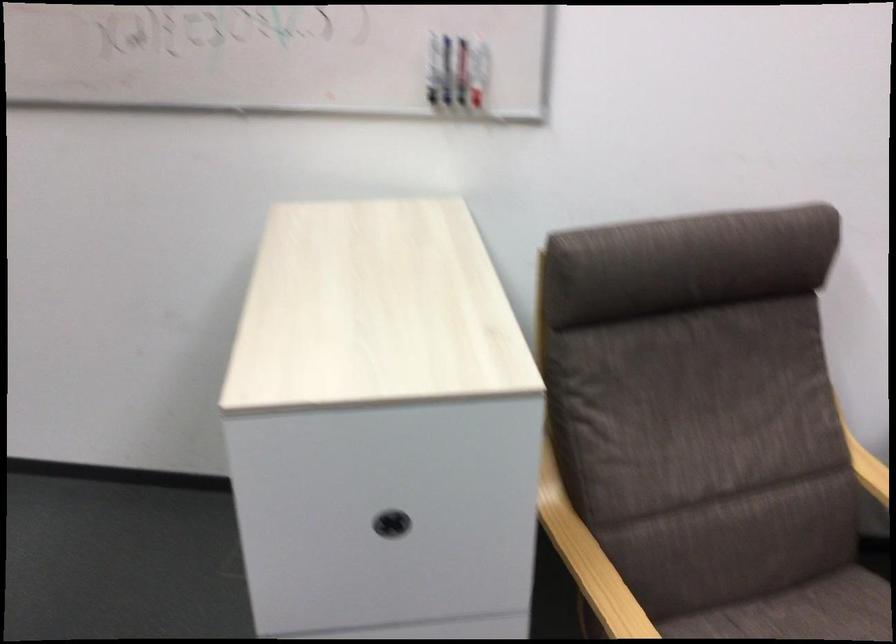
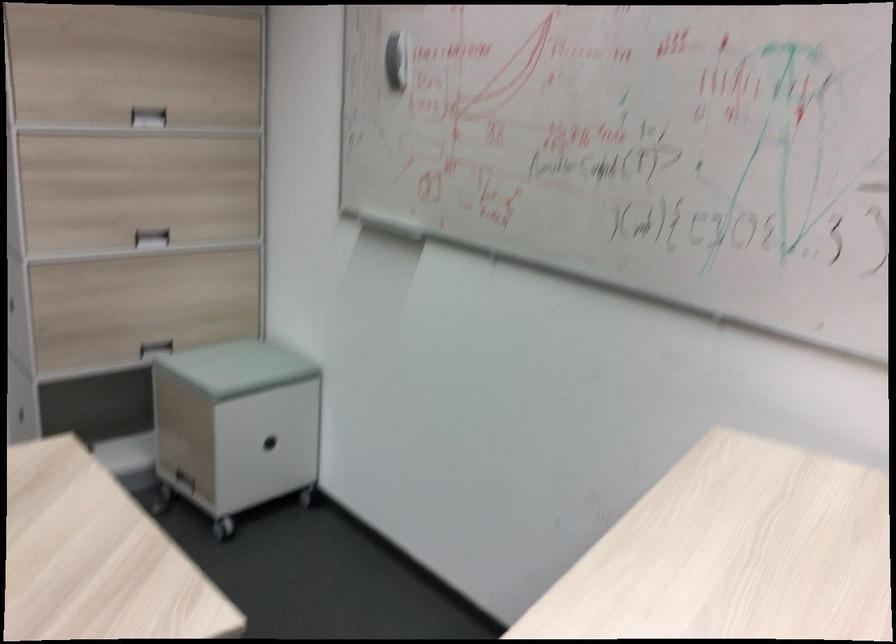
Question: The camera is either moving clockwise (left) or counter-clockwise (right) around the object. The first image is from the beginning of the video and the second image is from the end. Is the camera moving left or right when shooting the video?

Choices:
 (A) Left
 (B) Right

Answer: (B)